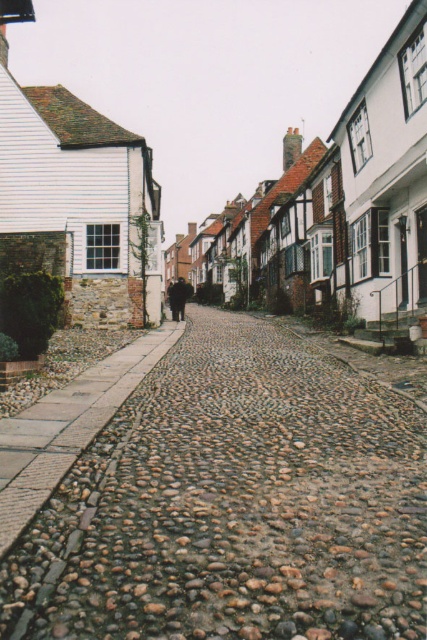
Question: Among these objects, which one is nearest to the camera?

Choices:
 (A) brown rough cobblestone at center
 (B) white wooden house at center
 (C) brown cobblestone path at lower left

Answer: (A)

Question: Which point appears farthest from the camera in this image?

Choices:
 (A) (17, 502)
 (B) (105, 492)

Answer: (B)

Question: Which point is farther to the camera?

Choices:
 (A) white wooden house at center
 (B) brown rough cobblestone at center
 (C) brown cobblestone path at lower left

Answer: (A)

Question: Does white wooden house at center appear under brown cobblestone path at lower left?

Choices:
 (A) no
 (B) yes

Answer: (A)

Question: From the image, what is the correct spatial relationship of brown rough cobblestone at center in relation to brown cobblestone path at lower left?

Choices:
 (A) left
 (B) right

Answer: (B)

Question: Does brown rough cobblestone at center have a greater width compared to white wooden house at center?

Choices:
 (A) no
 (B) yes

Answer: (A)